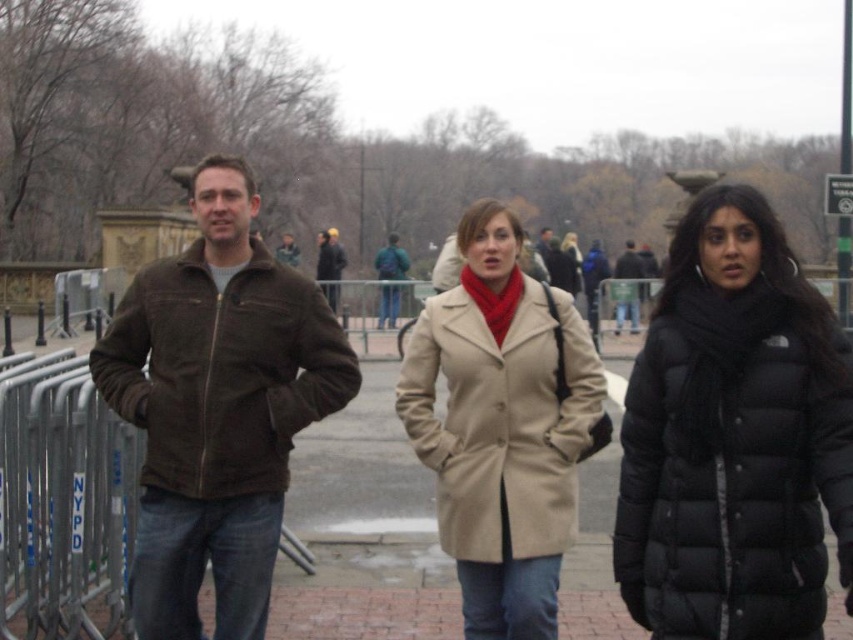
Is point (741, 193) farther from camera compared to point (84, 637)?

No, (741, 193) is closer to viewer.

Which is in front, point (759, 618) or point (378, 548)?

Point (759, 618) is in front.

Who is more forward, (838, 561) or (4, 596)?

Point (838, 561)

Identify the location of black puffer coat at center. This screenshot has width=853, height=640. (734, 436).

Does black puffer coat at center come in front of green fabric backpack at center?

Yes, black puffer coat at center is in front of green fabric backpack at center.

The width and height of the screenshot is (853, 640). Find the location of `black puffer coat at center`. black puffer coat at center is located at coordinates (734, 436).

Who is lower down, brown suede jacket at left or dark brown leather jacket at center?

brown suede jacket at left is below.

Who is more forward, (312, 371) or (627, 317)?

Point (312, 371)

Find the location of a particular element. The image size is (853, 640). brown suede jacket at left is located at coordinates (222, 371).